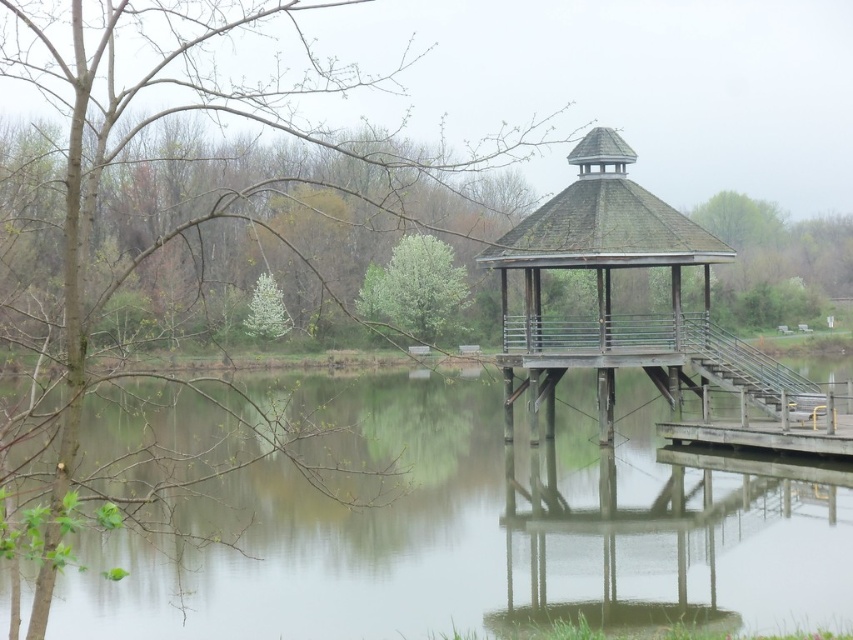
Between transparent water at center and green leafy tree at center, which one appears on the right side from the viewer's perspective?

transparent water at center

Is point (622, 502) behind point (419, 320)?

That is False.

Locate an element on the screen. transparent water at center is located at coordinates [x=480, y=532].

Who is more forward, (178, 56) or (544, 241)?

Point (544, 241) is in front.

Does green leafy tree at upper left lie behind wooden gazebo at center?

No, it is in front of wooden gazebo at center.

Who is more forward, (404,52) or (602,384)?

Point (602,384) is in front.

Find the location of a particular element. This screenshot has width=853, height=640. green leafy tree at upper left is located at coordinates [x=152, y=124].

Is green leafy tree at upper left further to camera compared to green leafy tree at center?

No, it is in front of green leafy tree at center.

Which is above, green leafy tree at upper left or green leafy tree at center?

green leafy tree at upper left is above.

Image resolution: width=853 pixels, height=640 pixels. What do you see at coordinates (152, 124) in the screenshot?
I see `green leafy tree at upper left` at bounding box center [152, 124].

At what (x,y) coordinates should I click in order to perform the action: click on green leafy tree at upper left. Please return your answer as a coordinate pair (x, y). Looking at the image, I should click on tap(152, 124).